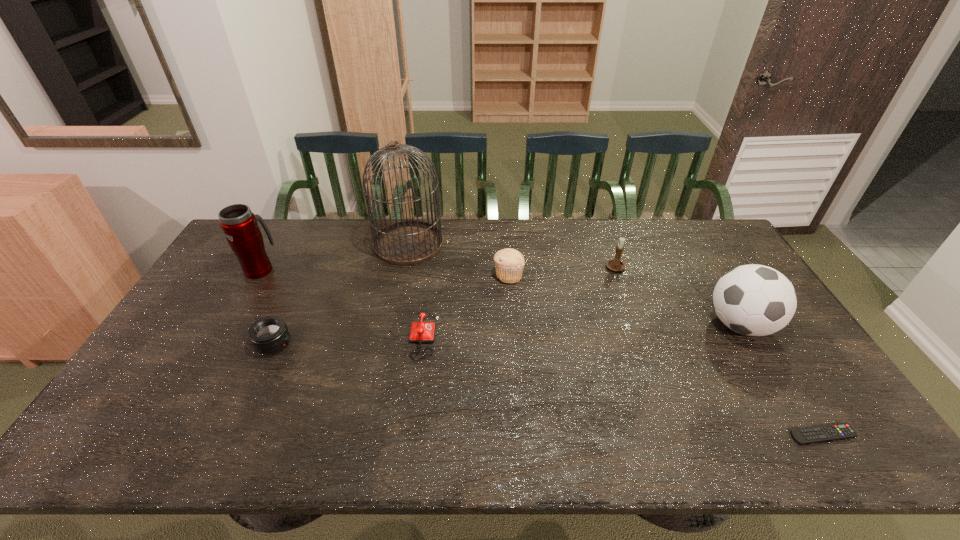
Select which object appears as the seventh closest to the nearest object. Please provide its 2D coordinates. Your answer should be formatted as a tuple, i.e. [(x, y)], where the tuple contains the x and y coordinates of a point satisfying the conditions above.

[(239, 224)]

Locate which object ranks fourth in proximity to the third tallest object. Please provide its 2D coordinates. Your answer should be formatted as a tuple, i.e. [(x, y)], where the tuple contains the x and y coordinates of a point satisfying the conditions above.

[(421, 332)]

The image size is (960, 540). In order to click on free region that satisfies the following two spatial constraints: 1. on the side of the sixth object from left to right with the handle; 2. on the dial of the telephone in this screenshot , I will do `click(640, 335)`.

The height and width of the screenshot is (540, 960). Find the location of `vacant space that satisfies the following two spatial constraints: 1. on the front side of the fifth object from left to right; 2. on the side of the telephoto lens with brand markings and control switches`. vacant space that satisfies the following two spatial constraints: 1. on the front side of the fifth object from left to right; 2. on the side of the telephoto lens with brand markings and control switches is located at coordinates (514, 343).

Where is `vacant space that satisfies the following two spatial constraints: 1. on the side with the handle of the birdcage; 2. on the right side of the leftmost object`? The width and height of the screenshot is (960, 540). vacant space that satisfies the following two spatial constraints: 1. on the side with the handle of the birdcage; 2. on the right side of the leftmost object is located at coordinates 276,244.

Image resolution: width=960 pixels, height=540 pixels. I want to click on vacant space that satisfies the following two spatial constraints: 1. on the front side of the third tallest object; 2. on the side of the telephoto lens with brand markings and control switches, so click(x=751, y=343).